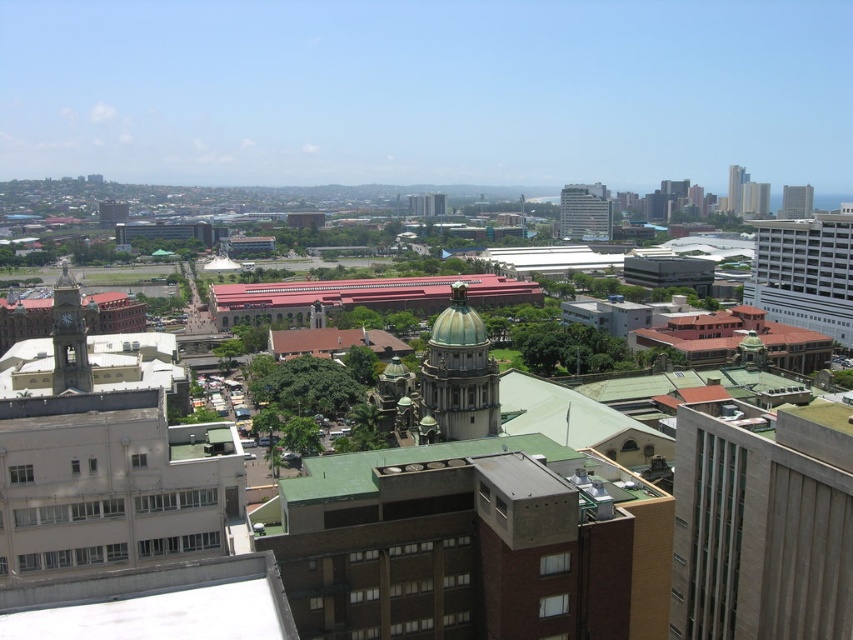
Question: Does matte glass building at center have a lesser width compared to matte gray skyscraper at upper right?

Choices:
 (A) no
 (B) yes

Answer: (A)

Question: In this image, where is green dome building at center located relative to matte gray clock tower at left?

Choices:
 (A) right
 (B) left

Answer: (A)

Question: Is matte gray skyscraper at upper right above glassy reflective skyscraper at upper right?

Choices:
 (A) yes
 (B) no

Answer: (B)

Question: Which point is farther to the camera?

Choices:
 (A) (457, 362)
 (B) (572, 193)
 (C) (740, 205)
 (D) (56, 365)

Answer: (C)

Question: Considering the real-world distances, which object is farthest from the matte gray clock tower at left?

Choices:
 (A) matte glass building at center
 (B) matte gray skyscraper at upper right
 (C) green dome building at center
 (D) glassy reflective skyscraper at upper right

Answer: (D)

Question: Which point appears closest to the camera in this image?

Choices:
 (A) (432, 429)
 (B) (733, 172)
 (C) (57, 346)

Answer: (A)